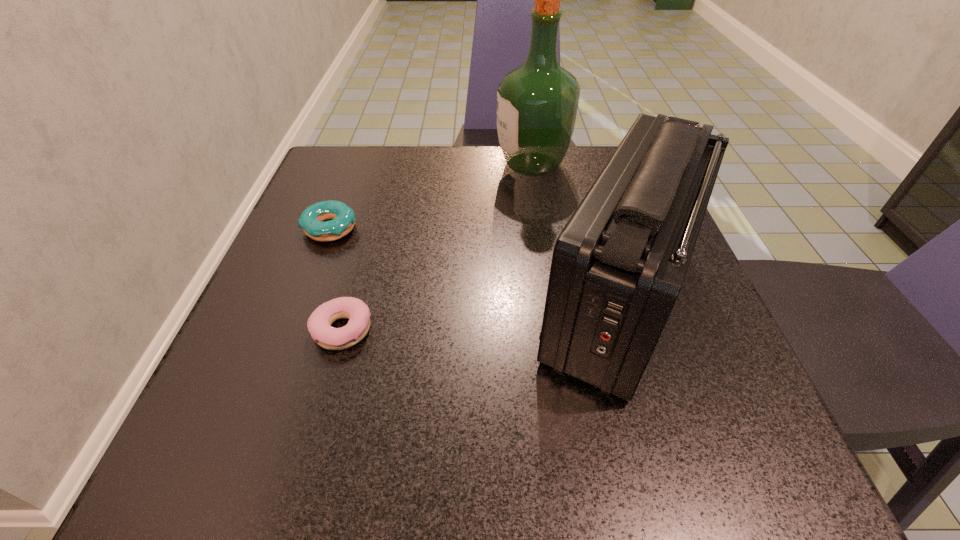
At what (x,y) coordinates should I click in order to perform the action: click on free space between the farther doughnut and the tallest object. Please return your answer as a coordinate pair (x, y). The height and width of the screenshot is (540, 960). Looking at the image, I should click on [431, 197].

Where is `free space between the farther doughnut and the tallest object`? This screenshot has width=960, height=540. free space between the farther doughnut and the tallest object is located at coordinates (431, 197).

Where is `free space between the nearer doughnut and the farther doughnut`? free space between the nearer doughnut and the farther doughnut is located at coordinates (336, 279).

Where is `empty location between the third shortest object and the nearer doughnut`? Image resolution: width=960 pixels, height=540 pixels. empty location between the third shortest object and the nearer doughnut is located at coordinates (480, 315).

Locate an element on the screen. The width and height of the screenshot is (960, 540). free spot between the farther doughnut and the tallest object is located at coordinates (431, 197).

I want to click on free spot between the farthest object and the nearer doughnut, so click(437, 247).

At what (x,y) coordinates should I click in order to perform the action: click on free point between the farther doughnut and the farthest object. Please return your answer as a coordinate pair (x, y). Looking at the image, I should click on (431, 197).

The image size is (960, 540). Identify the location of free point between the farther doughnut and the third shortest object. (474, 265).

Locate an element on the screen. free spot between the tallest object and the nearer doughnut is located at coordinates (437, 247).

Image resolution: width=960 pixels, height=540 pixels. Identify the location of the closest object to the liquor. (618, 265).